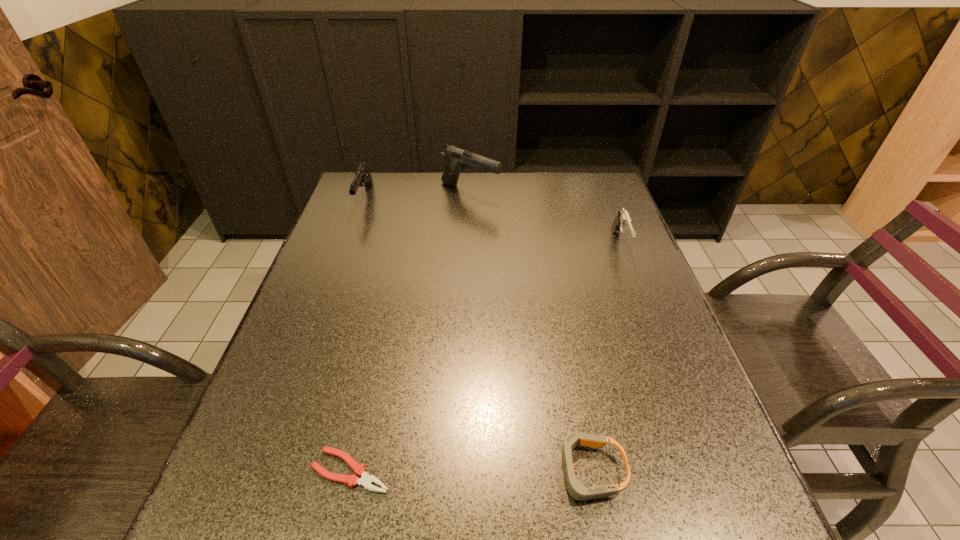
This screenshot has height=540, width=960. I want to click on free space that satisfies the following two spatial constraints: 1. at the end of the barrel of the leftmost object; 2. on the left side of the second object from left to right, so click(x=267, y=471).

Find the location of a particular element. The image size is (960, 540). vacant space that satisfies the following two spatial constraints: 1. at the end of the barrel of the fourth object from right to left; 2. on the right side of the leftmost gun is located at coordinates (267, 471).

Where is `vacant space that satisfies the following two spatial constraints: 1. at the muzzle of the nearest gun; 2. on the front and back of the second object from right to left`? vacant space that satisfies the following two spatial constraints: 1. at the muzzle of the nearest gun; 2. on the front and back of the second object from right to left is located at coordinates (708, 471).

Where is `free location that satisfies the following two spatial constraints: 1. at the muzzle of the rightmost object; 2. on the front and back of the fourth object from left to right`? The image size is (960, 540). free location that satisfies the following two spatial constraints: 1. at the muzzle of the rightmost object; 2. on the front and back of the fourth object from left to right is located at coordinates (708, 471).